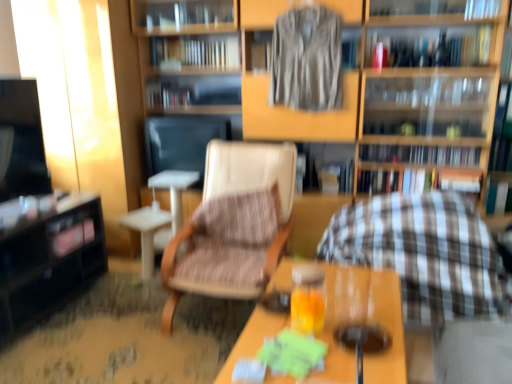
Where is `vacant area on the back side of translucent glass beverage at center`? Image resolution: width=512 pixels, height=384 pixels. vacant area on the back side of translucent glass beverage at center is located at coordinates (350, 310).